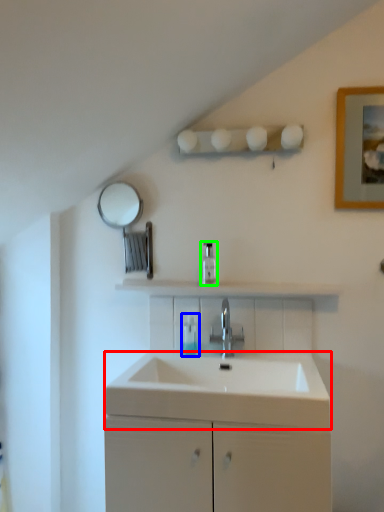
Question: Which object is positioned farthest from counter top (highlighted by a red box)? Select from toiletry (highlighted by a blue box) and soap dispenser (highlighted by a green box).

Choices:
 (A) toiletry
 (B) soap dispenser

Answer: (B)